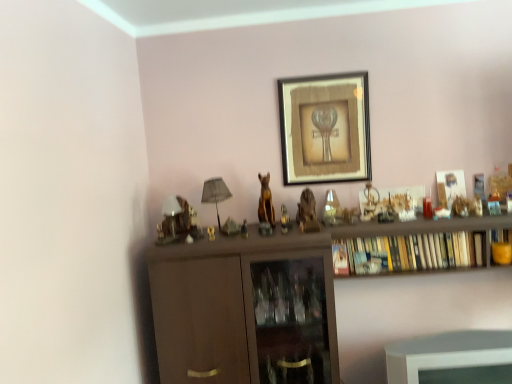
Question: Would you say matte brown statue at center, arranged as the third toy when viewed from the right, contains gold metallic statue at center, the first animal in the left-to-right sequence?

Choices:
 (A) no
 (B) yes

Answer: (A)

Question: Is there a large distance between matte brown statue at center, arranged as the third toy when viewed from the right, and gold metallic statue at center, the first animal in the left-to-right sequence?

Choices:
 (A) no
 (B) yes

Answer: (A)

Question: Is matte brown statue at center, arranged as the second toy when viewed from the left, to the left of gold metallic statue at center, which ranks as the second animal in right-to-left order, from the viewer's perspective?

Choices:
 (A) no
 (B) yes

Answer: (B)

Question: Is matte brown statue at center, arranged as the third toy when viewed from the right, touching gold metallic statue at center, the first animal in the left-to-right sequence?

Choices:
 (A) no
 (B) yes

Answer: (A)

Question: Does matte brown statue at center, arranged as the second toy when viewed from the left, appear on the right side of gold metallic statue at center, which ranks as the second animal in right-to-left order?

Choices:
 (A) no
 (B) yes

Answer: (A)

Question: From a real-world perspective, is matte brown statue at center, arranged as the second toy when viewed from the left, physically above gold metallic statue at center, the first animal in the left-to-right sequence?

Choices:
 (A) yes
 (B) no

Answer: (B)

Question: From a real-world perspective, is metallic gold statue at center, placed as the third toy when sorted from left to right, physically above wooden statue at center, acting as the first animal starting from the right?

Choices:
 (A) yes
 (B) no

Answer: (B)

Question: Can you confirm if metallic gold statue at center, which is counted as the 2th toy, starting from the right, is smaller than wooden statue at center, acting as the first animal starting from the right?

Choices:
 (A) no
 (B) yes

Answer: (B)

Question: Is metallic gold statue at center, which is counted as the 2th toy, starting from the right, aimed at wooden statue at center, acting as the first animal starting from the right?

Choices:
 (A) no
 (B) yes

Answer: (A)

Question: From the image's perspective, is metallic gold statue at center, which is counted as the 2th toy, starting from the right, under wooden statue at center, which is the second animal in left-to-right order?

Choices:
 (A) no
 (B) yes

Answer: (B)

Question: Is metallic gold statue at center, which is counted as the 2th toy, starting from the right, closer to the viewer compared to wooden statue at center, which is the second animal in left-to-right order?

Choices:
 (A) no
 (B) yes

Answer: (A)

Question: Does metallic gold statue at center, placed as the third toy when sorted from left to right, appear on the left side of wooden statue at center, acting as the first animal starting from the right?

Choices:
 (A) yes
 (B) no

Answer: (A)

Question: Can you confirm if matte brown statue at center, arranged as the third toy when viewed from the right, is shorter than wooden bookshelf at center?

Choices:
 (A) no
 (B) yes

Answer: (B)